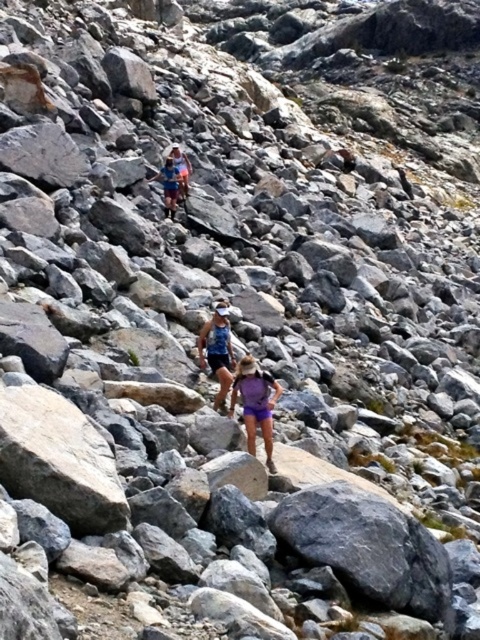
Question: Among these points, which one is nearest to the camera?

Choices:
 (A) (215, 372)
 (B) (164, 184)
 (C) (182, 195)

Answer: (A)

Question: Is purple fabric backpack at center thinner than blue fabric shorts at center?

Choices:
 (A) no
 (B) yes

Answer: (B)

Question: Can you confirm if purple fabric backpack at center is thinner than matte blue tank top at center?

Choices:
 (A) no
 (B) yes

Answer: (A)

Question: Among these objects, which one is farthest from the camera?

Choices:
 (A) blue fabric shorts at center
 (B) matte blue backpack at center

Answer: (B)

Question: Is purple fabric backpack at center above matte blue tank top at center?

Choices:
 (A) no
 (B) yes

Answer: (A)

Question: Which point is farther from the camera taking this photo?

Choices:
 (A) (216, 365)
 (B) (187, 164)

Answer: (B)